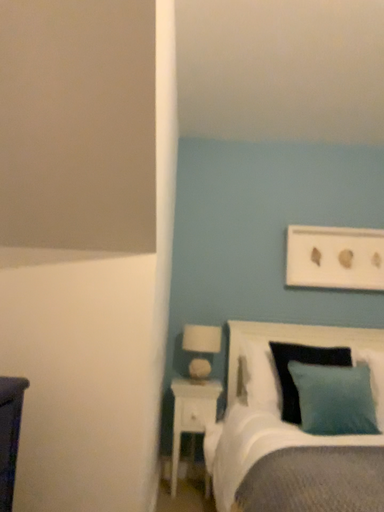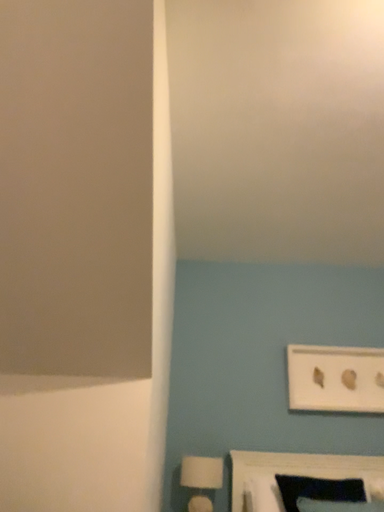
Question: Which way did the camera rotate in the video?

Choices:
 (A) rotated downward
 (B) rotated upward

Answer: (B)